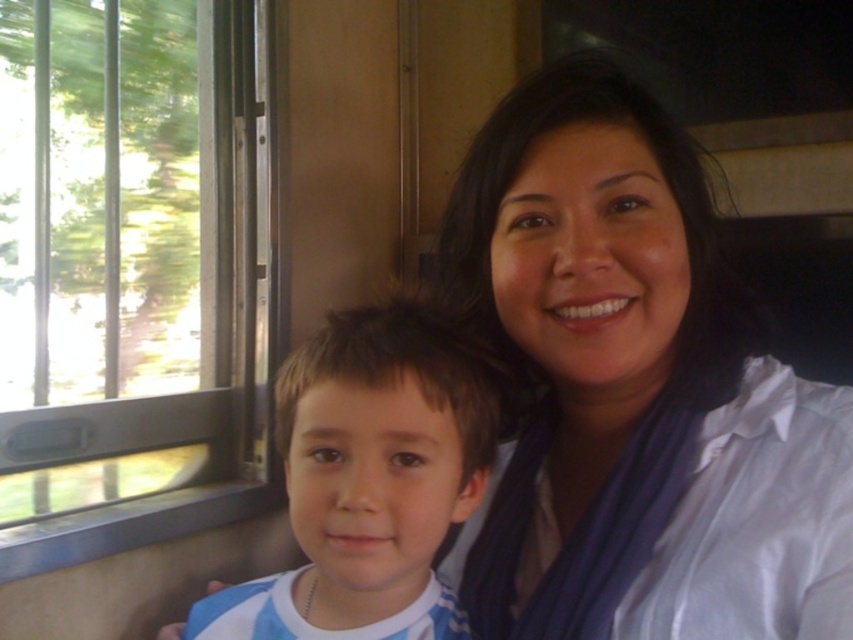
Question: Estimate the real-world distances between objects in this image. Which object is farther from the clear glass window at left?

Choices:
 (A) blue striped shirt at center
 (B) white satin blouse at upper right

Answer: (B)

Question: Can you confirm if clear glass window at left is thinner than blue striped shirt at center?

Choices:
 (A) yes
 (B) no

Answer: (B)

Question: Does clear glass window at left have a lesser width compared to blue striped shirt at center?

Choices:
 (A) no
 (B) yes

Answer: (A)

Question: Is white satin blouse at upper right wider than clear glass window at left?

Choices:
 (A) yes
 (B) no

Answer: (B)

Question: Which point is farther to the camera?

Choices:
 (A) (564, 145)
 (B) (207, 248)
 (C) (378, 497)

Answer: (B)

Question: Estimate the real-world distances between objects in this image. Which object is closer to the blue striped shirt at center?

Choices:
 (A) clear glass window at left
 (B) white satin blouse at upper right

Answer: (B)